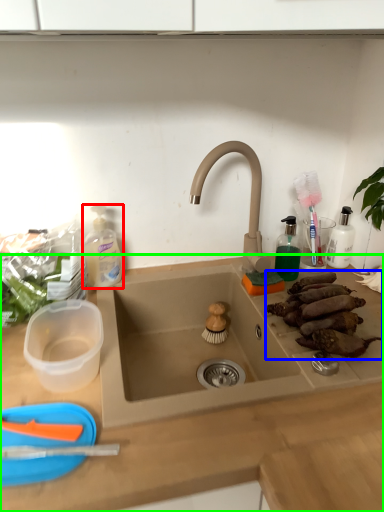
Question: Considering the real-world distances, which object is farthest from cleaning product (highlighted by a red box)? food (highlighted by a blue box) or countertop (highlighted by a green box)?

Choices:
 (A) food
 (B) countertop

Answer: (A)